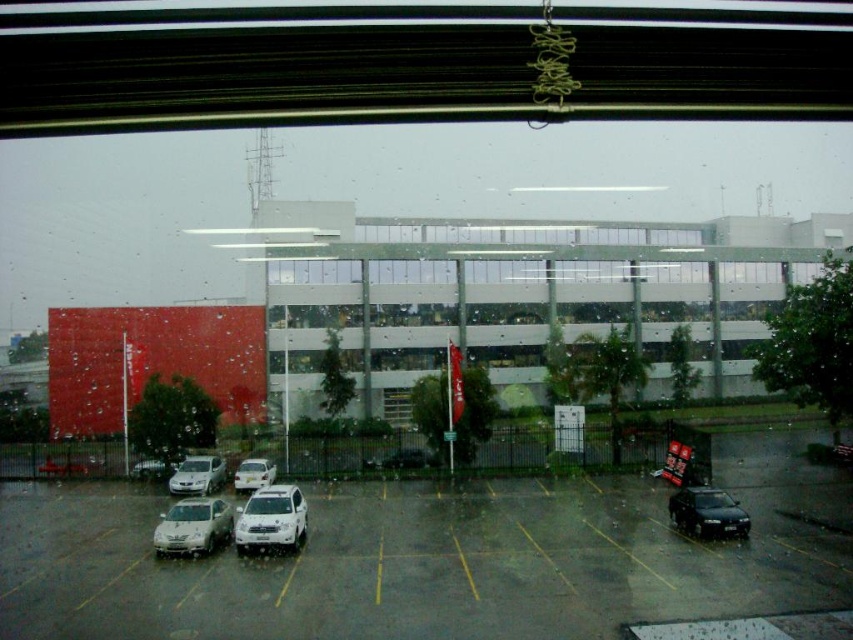
Based on the photo, you are standing inside the building and looking through the window. You see the gray asphalt parking lot at lower center and the white glossy building at center. Which object is located to the left of the other?

The gray asphalt parking lot at lower center is positioned on the left side of white glossy building at center.

You are standing inside the building and looking through the window. You see the gray asphalt parking lot at lower center and the white glossy building at center. Which object is closer to you from your current position?

The gray asphalt parking lot at lower center is closer to you because it is positioned under the white glossy building at center, meaning it is located in front of the building from your viewpoint inside.

In the scene shown: You are standing inside the building and looking through the window. You see the satin white suv at center and the satin silver sedan at lower left. Which vehicle is closer to you?

The satin white suv at center is closer to the viewer than the satin silver sedan at lower left.